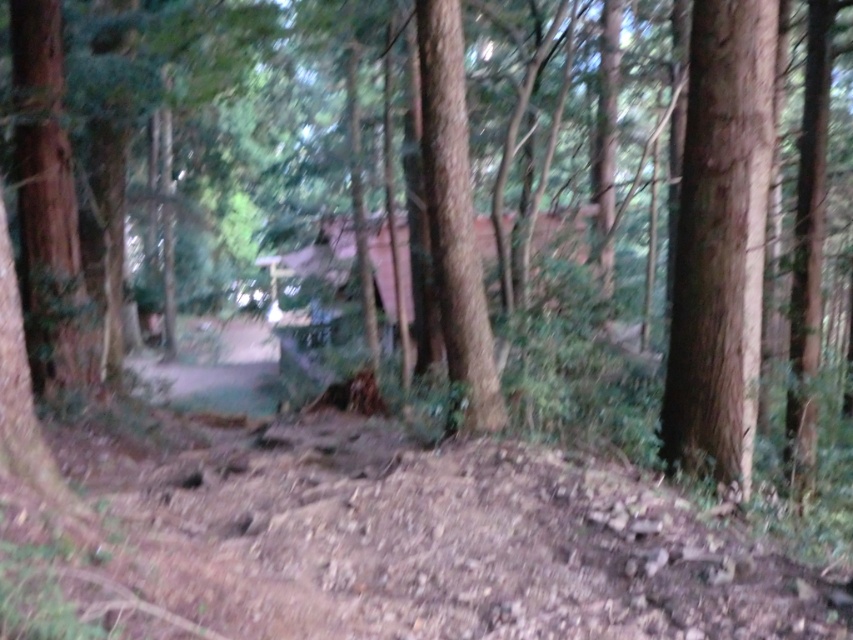
Measure the distance between point [61,584] and camera.

Point [61,584] is 2.57 meters away from camera.

Can you confirm if brown dirt track at lower center is bigger than smooth brown tree trunk at center?

Correct, brown dirt track at lower center is larger in size than smooth brown tree trunk at center.

The image size is (853, 640). I want to click on brown dirt track at lower center, so click(x=386, y=544).

Between brown dirt track at lower center and smooth brown tree trunk at right, which one is positioned higher?

smooth brown tree trunk at right

Does brown dirt track at lower center have a lesser width compared to smooth brown tree trunk at right?

No.

Locate an element on the screen. brown dirt track at lower center is located at coordinates (386, 544).

Locate an element on the screen. The height and width of the screenshot is (640, 853). brown dirt track at lower center is located at coordinates (386, 544).

Is smooth brown tree trunk at right to the left of smooth brown tree trunk at center from the viewer's perspective?

No, smooth brown tree trunk at right is not to the left of smooth brown tree trunk at center.

Who is positioned more to the right, smooth brown tree trunk at right or smooth brown tree trunk at center?

Positioned to the right is smooth brown tree trunk at right.

Which is behind, point (686, 436) or point (431, 76)?

Positioned behind is point (431, 76).

This screenshot has width=853, height=640. Identify the location of smooth brown tree trunk at right. (720, 241).